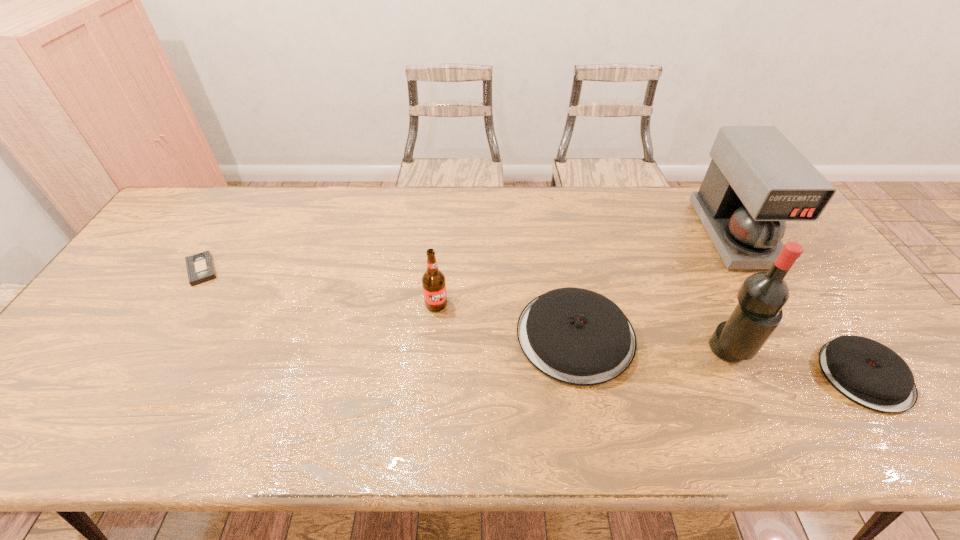
Please point a vacant point for placing a pancake on the left. Please provide its 2D coordinates. Your answer should be formatted as a tuple, i.e. [(x, y)], where the tuple contains the x and y coordinates of a point satisfying the conditions above.

[(324, 301)]